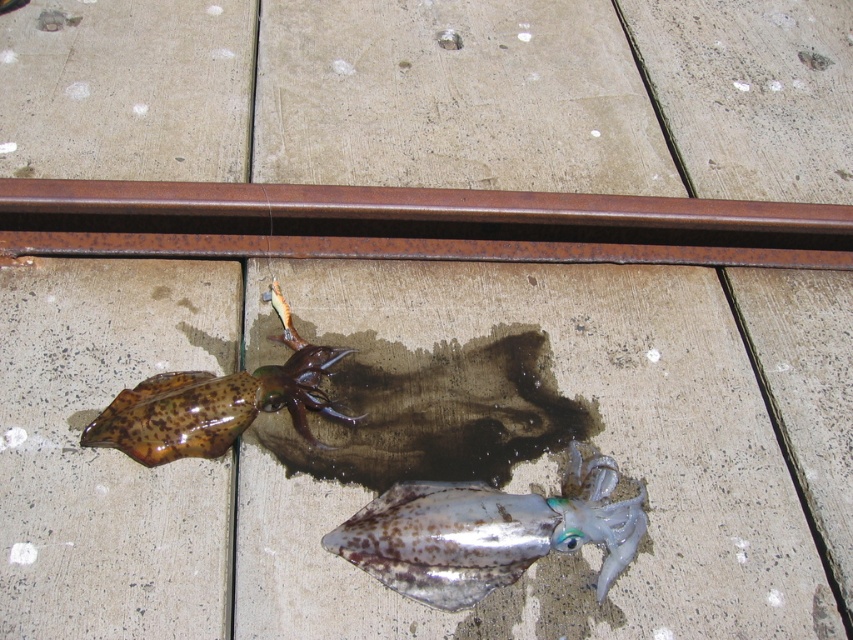
Question: Which object appears closest to the camera in this image?

Choices:
 (A) brown glossy squid at upper left
 (B) rusty metal rail at center

Answer: (A)

Question: Is rusty metal rail at center above speckled translucent squid at center?

Choices:
 (A) no
 (B) yes

Answer: (B)

Question: Is rusty metal rail at center thinner than brown glossy squid at upper left?

Choices:
 (A) no
 (B) yes

Answer: (A)

Question: Among these objects, which one is nearest to the camera?

Choices:
 (A) speckled translucent squid at center
 (B) rusty metal rail at center

Answer: (A)

Question: From the image, what is the correct spatial relationship of rusty metal rail at center in relation to brown glossy squid at upper left?

Choices:
 (A) above
 (B) below

Answer: (A)

Question: Among these points, which one is nearest to the camera?

Choices:
 (A) (454, 608)
 (B) (840, 262)

Answer: (A)